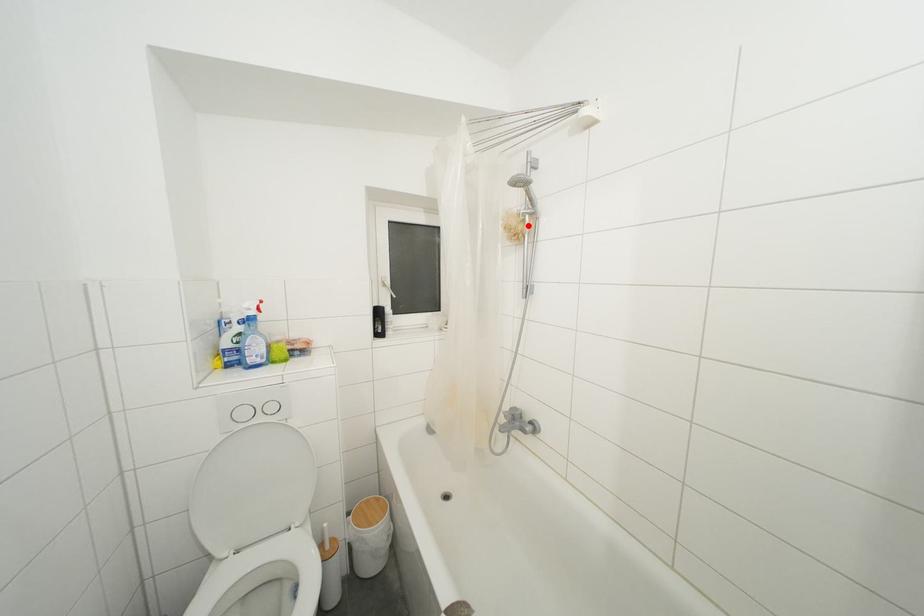
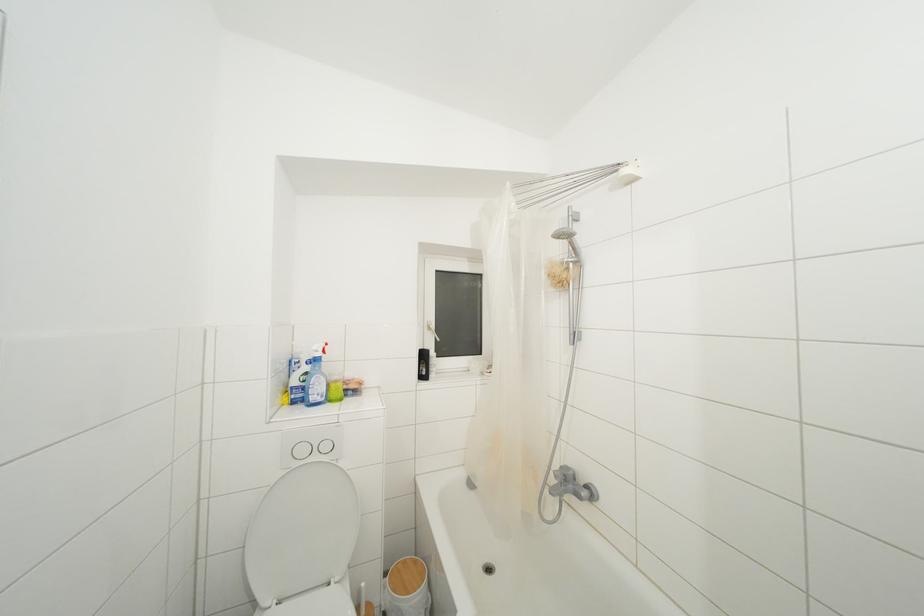
Locate, in the second image, the point that corresponds to the highlighted location in the first image.

(572, 273)